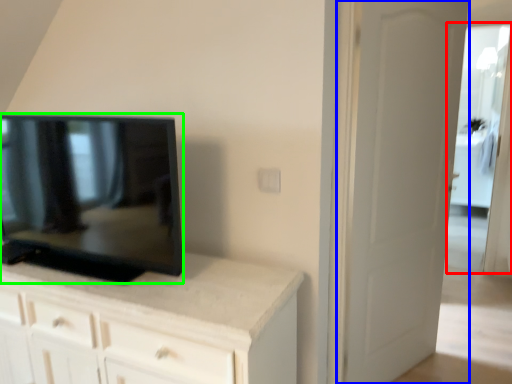
Question: Which object is the closest to the glass door (highlighted by a red box)? Choose among these: door (highlighted by a blue box) or television (highlighted by a green box).

Choices:
 (A) door
 (B) television

Answer: (A)